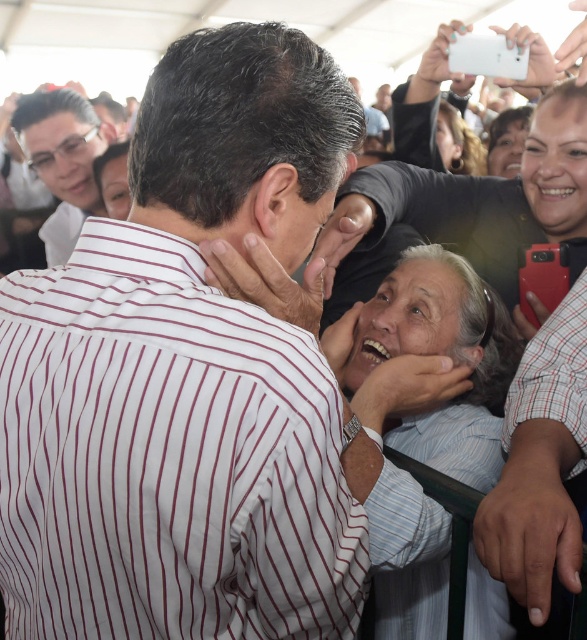
Is point (396, 392) behind point (77, 193)?

No, (396, 392) is in front of (77, 193).

Locate an element on the screen. This screenshot has height=640, width=587. light blue striped shirt at center is located at coordinates (421, 419).

I want to click on light blue striped shirt at center, so click(421, 419).

Does white striped shirt at center have a lesser height compared to matte black glasses at upper left?

Incorrect, white striped shirt at center's height does not fall short of matte black glasses at upper left's.

Can you confirm if white striped shirt at center is positioned above matte black glasses at upper left?

No, white striped shirt at center is not above matte black glasses at upper left.

Which is in front, point (173, 561) or point (32, 138)?

Point (173, 561)

The image size is (587, 640). Find the location of `white striped shirt at center`. white striped shirt at center is located at coordinates (185, 376).

Who is positioned more to the right, white striped shirt at center or light blue striped shirt at center?

light blue striped shirt at center

Can you confirm if white striped shirt at center is shorter than light blue striped shirt at center?

Yes, white striped shirt at center is shorter than light blue striped shirt at center.

Is point (68, 365) farther from viewer compared to point (433, 596)?

No, it is not.

Find the location of a particular element. The image size is (587, 640). white striped shirt at center is located at coordinates (185, 376).